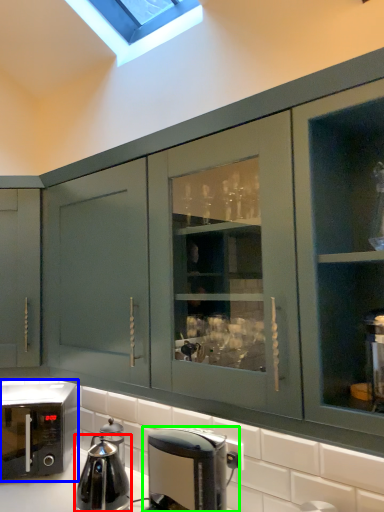
Question: Which object is positioned farthest from kitchen appliance (highlighted by a red box)? Select from home appliance (highlighted by a blue box) and coffee maker (highlighted by a green box).

Choices:
 (A) home appliance
 (B) coffee maker

Answer: (B)